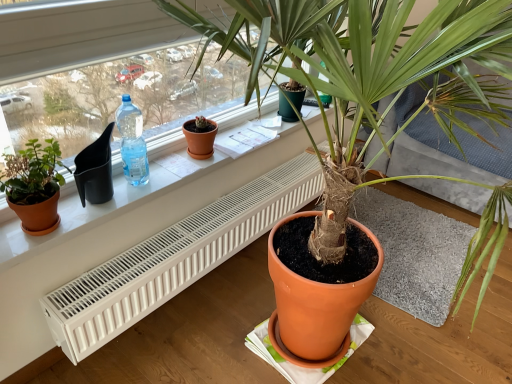
Find the location of `blank space above matte white radiator at lower center (from a real-world perspective)`. blank space above matte white radiator at lower center (from a real-world perspective) is located at coordinates (181, 159).